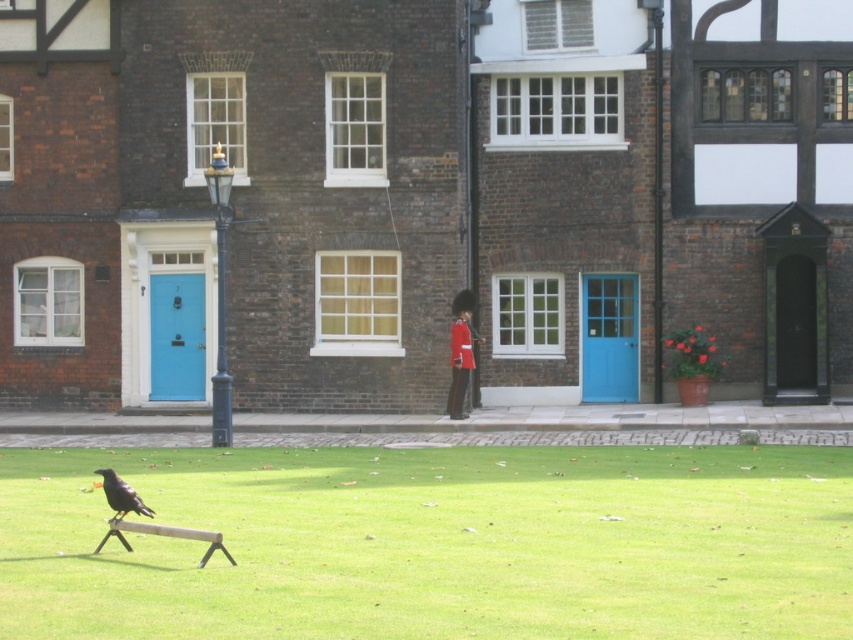
Question: Which of these objects is positioned closest to the shiny black bird at lower left?

Choices:
 (A) wooden park bench at lower center
 (B) green grass at lower center
 (C) shiny red uniform at center

Answer: (A)

Question: Which point is farther to the camera?

Choices:
 (A) green grass at lower center
 (B) shiny black bird at lower left

Answer: (B)

Question: Is green grass at lower center positioned at the back of shiny red uniform at center?

Choices:
 (A) yes
 (B) no

Answer: (B)

Question: Which of the following is the closest to the observer?

Choices:
 (A) shiny red uniform at center
 (B) shiny black bird at lower left
 (C) green grass at lower center
 (D) wooden park bench at lower center

Answer: (C)

Question: In this image, where is green grass at lower center located relative to shiny red uniform at center?

Choices:
 (A) below
 (B) above

Answer: (A)

Question: Is green grass at lower center in front of shiny red uniform at center?

Choices:
 (A) yes
 (B) no

Answer: (A)